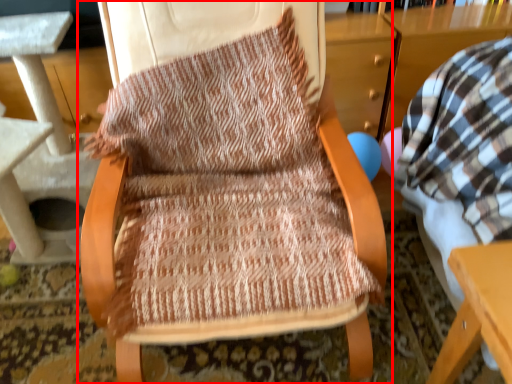
Question: In this image, where is chair (annotated by the red box) located relative to table?

Choices:
 (A) right
 (B) left

Answer: (A)